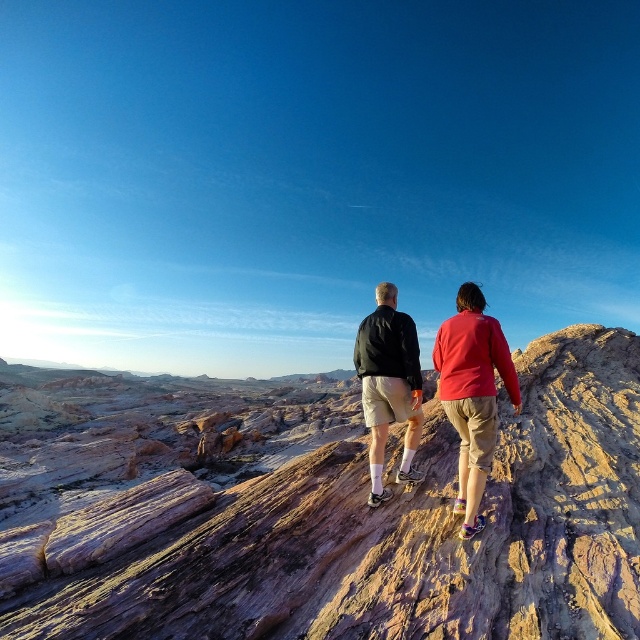
Question: Is matte black jacket at center thinner than black matte jacket at center?

Choices:
 (A) no
 (B) yes

Answer: (A)

Question: Which object appears farthest from the camera in this image?

Choices:
 (A) black matte jacket at center
 (B) rustic stone mountain at center
 (C) matte black jacket at center

Answer: (A)

Question: Can you confirm if rustic stone mountain at center is smaller than matte black jacket at center?

Choices:
 (A) yes
 (B) no

Answer: (B)

Question: Which object is positioned farthest from the rustic stone mountain at center?

Choices:
 (A) black matte jacket at center
 (B) matte black jacket at center

Answer: (A)

Question: Is rustic stone mountain at center in front of matte black jacket at center?

Choices:
 (A) yes
 (B) no

Answer: (A)

Question: Which point is closer to the camera?

Choices:
 (A) (362, 320)
 (B) (241, 580)
 (C) (468, 385)

Answer: (B)